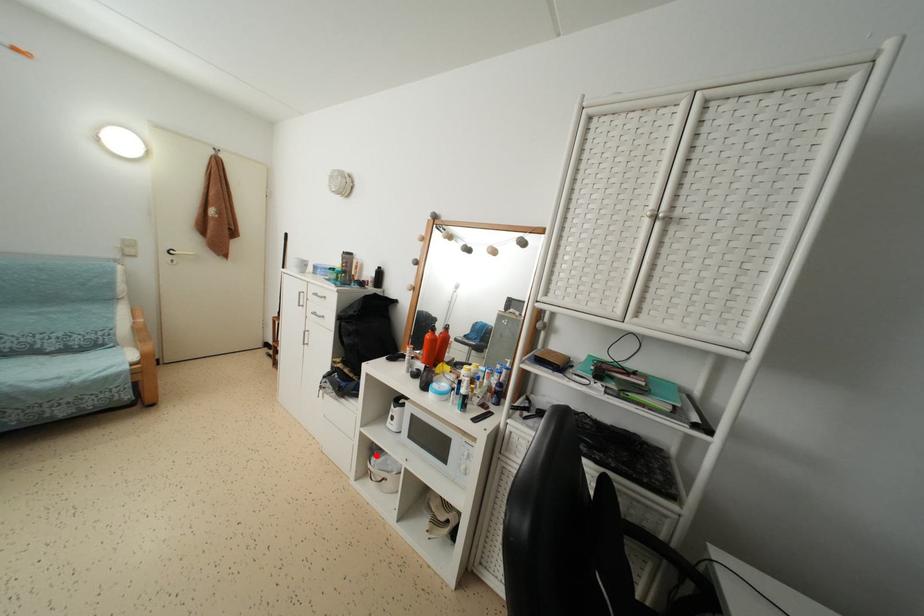
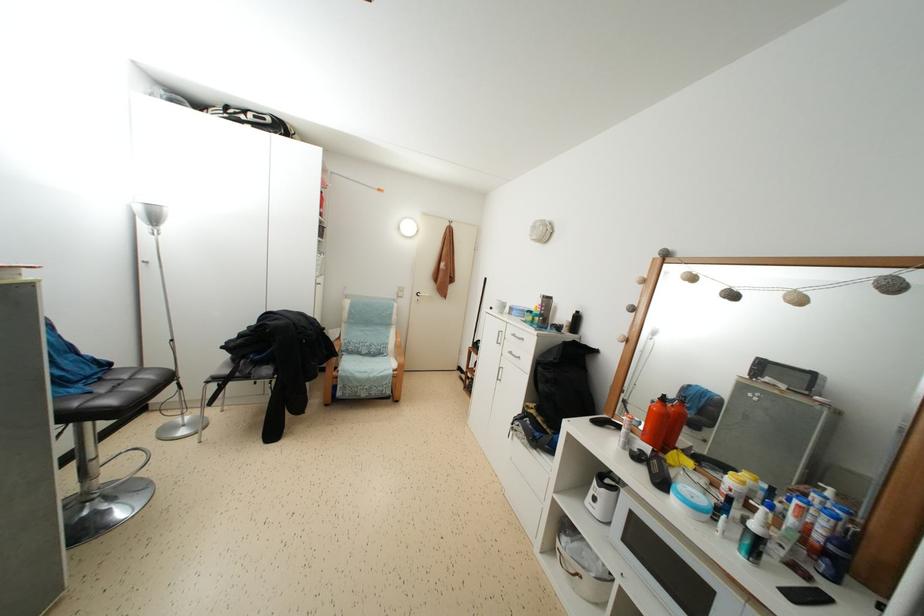
Find the pixel in the second image that matches the highlighted location in the first image.

(566, 532)